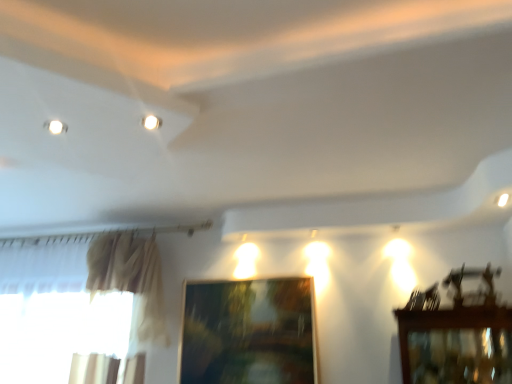
Image resolution: width=512 pixels, height=384 pixels. I want to click on white glossy light at upper right, so click(503, 200).

What is the approximate height of wooden picture frame at center?

wooden picture frame at center is 27.40 inches in height.

The width and height of the screenshot is (512, 384). Find the location of `white glossy light fixture at upper center`. white glossy light fixture at upper center is located at coordinates (152, 122).

Looking at this image, is white glossy light at upper right oriented away from wooden picture frame at center?

No.

Is white glossy light at upper right at the right side of wooden picture frame at center?

Indeed, white glossy light at upper right is positioned on the right side of wooden picture frame at center.

From the image's perspective, would you say white glossy light at upper right is positioned over wooden picture frame at center?

Yes.

In terms of height, does white glossy light at upper right look taller or shorter compared to wooden picture frame at center?

Considering their sizes, white glossy light at upper right has less height than wooden picture frame at center.

Would you say wooden picture frame at center is part of white glossy light fixture at upper center's contents?

Actually, wooden picture frame at center is outside white glossy light fixture at upper center.

Does white glossy light fixture at upper center have a smaller size compared to wooden picture frame at center?

Yes, white glossy light fixture at upper center is smaller than wooden picture frame at center.

Which is behind, white glossy light fixture at upper center or wooden picture frame at center?

wooden picture frame at center is further away from the camera.

Is wooden picture frame at center taller than white glossy light fixture at upper center?

Yes, wooden picture frame at center is taller than white glossy light fixture at upper center.

Does wooden picture frame at center have a lesser width compared to white glossy light fixture at upper center?

Correct, the width of wooden picture frame at center is less than that of white glossy light fixture at upper center.

Is wooden picture frame at center facing away from white glossy light fixture at upper center?

No, wooden picture frame at center is not facing away from white glossy light fixture at upper center.

Do you think wooden picture frame at center is within white glossy light fixture at upper center, or outside of it?

wooden picture frame at center is outside white glossy light fixture at upper center.

Considering the relative sizes of white glossy light fixture at upper center and white glossy light at upper right in the image provided, is white glossy light fixture at upper center shorter than white glossy light at upper right?

Yes, white glossy light fixture at upper center is shorter than white glossy light at upper right.

The image size is (512, 384). What are the coordinates of `light below the white glossy light fixture at upper center (from a real-world perspective)` in the screenshot? It's located at (503, 200).

From a real-world perspective, between white glossy light fixture at upper center and white glossy light at upper right, who is vertically lower?

white glossy light at upper right.

Looking at the image, does wooden picture frame at center seem bigger or smaller compared to white glossy light at upper right?

In the image, wooden picture frame at center appears to be larger than white glossy light at upper right.

Looking at this image, from the image's perspective, relative to white glossy light at upper right, is wooden picture frame at center above or below?

Clearly, from the image's perspective, wooden picture frame at center is below white glossy light at upper right.

Is wooden picture frame at center next to white glossy light at upper right and touching it?

No, wooden picture frame at center is not in contact with white glossy light at upper right.

Does white glossy light at upper right have a lesser width compared to white glossy light fixture at upper center?

Incorrect, the width of white glossy light at upper right is not less than that of white glossy light fixture at upper center.

Is white glossy light at upper right next to white glossy light fixture at upper center?

No, white glossy light at upper right is not touching white glossy light fixture at upper center.

Is white glossy light at upper right in front of or behind white glossy light fixture at upper center in the image?

Clearly, white glossy light at upper right is behind white glossy light fixture at upper center.

This screenshot has height=384, width=512. I want to click on light above the wooden picture frame at center (from the image's perspective), so click(x=503, y=200).

At what (x,y) coordinates should I click in order to perform the action: click on picture frame directly beneath the white glossy light fixture at upper center (from a real-world perspective). Please return your answer as a coordinate pair (x, y). Looking at the image, I should click on (248, 332).

Estimate the real-world distances between objects in this image. Which object is closer to wooden picture frame at center, white glossy light at upper right or white glossy light fixture at upper center?

Based on the image, white glossy light at upper right appears to be nearer to wooden picture frame at center.

When comparing their distances from wooden picture frame at center, does white glossy light fixture at upper center or white glossy light at upper right seem further?

white glossy light fixture at upper center lies further to wooden picture frame at center than the other object.

Based on their spatial positions, is wooden picture frame at center or white glossy light at upper right further from white glossy light fixture at upper center?

wooden picture frame at center is positioned further to the anchor white glossy light fixture at upper center.

Estimate the real-world distances between objects in this image. Which object is further from white glossy light fixture at upper center, white glossy light at upper right or wooden picture frame at center?

wooden picture frame at center lies further to white glossy light fixture at upper center than the other object.

Which object lies nearer to the anchor point white glossy light at upper right, white glossy light fixture at upper center or wooden picture frame at center?

white glossy light fixture at upper center is positioned closer to the anchor white glossy light at upper right.

Based on their spatial positions, is wooden picture frame at center or white glossy light fixture at upper center further from white glossy light at upper right?

wooden picture frame at center is positioned further to the anchor white glossy light at upper right.

This screenshot has width=512, height=384. Find the location of `picture frame situated between white glossy light fixture at upper center and white glossy light at upper right from left to right`. picture frame situated between white glossy light fixture at upper center and white glossy light at upper right from left to right is located at coordinates (248, 332).